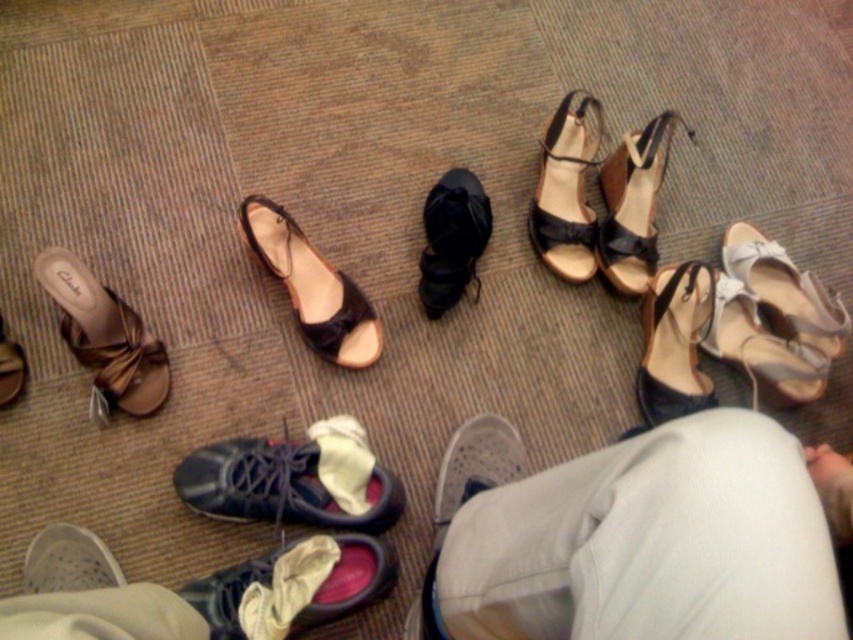
You are organizing a shoe rack and need to place the shiny black sneaker at lower center and the matte black sandal at center. Which one requires a larger space on the rack?

The matte black sandal at center requires a larger space on the rack because it is bigger than the shiny black sneaker at lower center.

Consider the image. You are trying to decide which pair of shoes to take for a walk. You have a choice between the shiny black sneaker at lower center and the matte black sandal at center. Based on their appearance, which one might be more comfortable for walking?

The shiny black sneaker at lower center might be more comfortable for walking since sneakers typically provide better support and cushioning compared to sandals.

You are standing in a room and want to pick up the shiny black sneaker at lower center and the matte black sandal at center. Which one do you need to bend down more to reach?

The shiny black sneaker at lower center is closer to the viewer than the matte black sandal at center, so you would need to bend down less to reach it compared to the matte black sandal at center. Therefore, you need to bend down more to reach the matte black sandal at center.